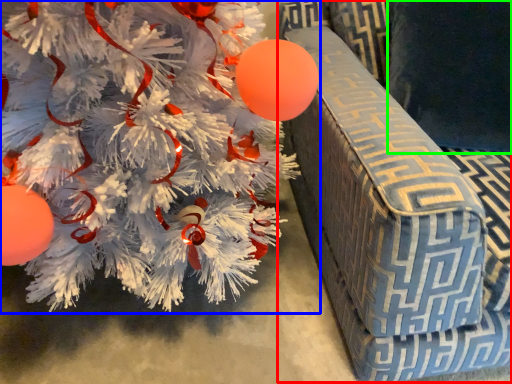
Question: Which object is positioned closest to armchair (highlighted by a red box)? Select from christmas tree (highlighted by a blue box) and pillow (highlighted by a green box).

Choices:
 (A) christmas tree
 (B) pillow

Answer: (B)